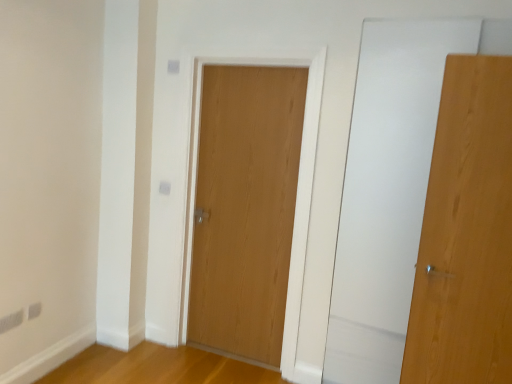
What is the approximate height of natural wood door at right, the second door positioned from the back?

natural wood door at right, the second door positioned from the back, is 1.76 meters tall.

The image size is (512, 384). What are the coordinates of `natural wood door at right, acting as the 1th door starting from the front` in the screenshot? It's located at click(466, 233).

The height and width of the screenshot is (384, 512). Describe the element at coordinates (466, 233) in the screenshot. I see `natural wood door at right, which appears as the 1th door when viewed from the right` at that location.

What do you see at coordinates (245, 208) in the screenshot?
I see `light oak wood door at center, which is the 2th door from front to back` at bounding box center [245, 208].

What is the approximate width of light oak wood door at center, placed as the first door when sorted from left to right?

light oak wood door at center, placed as the first door when sorted from left to right, is 3.90 inches wide.

You are a GUI agent. You are given a task and a screenshot of the screen. Output one action in this format:
    pyautogui.click(x=<x>, y=<y>)
    Task: Click on the light oak wood door at center, which is the 2th door from front to back
    
    Given the screenshot: What is the action you would take?
    pyautogui.click(x=245, y=208)

What is the approximate height of light oak wood door at center, which is the 2th door from front to back?

6.38 feet.

Locate an element on the screen. natural wood door at right, acting as the 1th door starting from the front is located at coordinates pos(466,233).

Between natural wood door at right, placed as the 2th door when sorted from left to right, and light oak wood door at center, placed as the first door when sorted from back to front, which one appears on the right side from the viewer's perspective?

From the viewer's perspective, natural wood door at right, placed as the 2th door when sorted from left to right, appears more on the right side.

Between natural wood door at right, placed as the 2th door when sorted from left to right, and light oak wood door at center, positioned as the 2th door in right-to-left order, which one is positioned in front?

natural wood door at right, placed as the 2th door when sorted from left to right, is in front.

Between point (509, 279) and point (225, 317), which one is positioned behind?

The point (225, 317) is behind.

From the image's perspective, which is below, natural wood door at right, the second door positioned from the back, or light oak wood door at center, placed as the first door when sorted from left to right?

natural wood door at right, the second door positioned from the back, from the image's perspective.

From a real-world perspective, is natural wood door at right, acting as the 1th door starting from the front, physically located above or below light oak wood door at center, placed as the first door when sorted from left to right?

natural wood door at right, acting as the 1th door starting from the front, is situated higher than light oak wood door at center, placed as the first door when sorted from left to right, in the real world.

Which object is thinner, natural wood door at right, which appears as the 1th door when viewed from the right, or light oak wood door at center, placed as the first door when sorted from back to front?

With smaller width is natural wood door at right, which appears as the 1th door when viewed from the right.

In terms of height, does natural wood door at right, the second door positioned from the back, look taller or shorter compared to light oak wood door at center, placed as the first door when sorted from left to right?

Considering their sizes, natural wood door at right, the second door positioned from the back, has less height than light oak wood door at center, placed as the first door when sorted from left to right.

Considering the sizes of objects natural wood door at right, acting as the 1th door starting from the front, and light oak wood door at center, which is the 2th door from front to back, in the image provided, who is smaller, natural wood door at right, acting as the 1th door starting from the front, or light oak wood door at center, which is the 2th door from front to back,?

natural wood door at right, acting as the 1th door starting from the front, is smaller.

Is natural wood door at right, the second door positioned from the back, positioned beyond the bounds of light oak wood door at center, positioned as the 2th door in right-to-left order?

Absolutely, natural wood door at right, the second door positioned from the back, is external to light oak wood door at center, positioned as the 2th door in right-to-left order.

In the scene shown: Is natural wood door at right, which appears as the 1th door when viewed from the right, beside light oak wood door at center, placed as the first door when sorted from left to right?

No, natural wood door at right, which appears as the 1th door when viewed from the right, is not in contact with light oak wood door at center, placed as the first door when sorted from left to right.

Could you tell me if natural wood door at right, the second door positioned from the back, is turned towards light oak wood door at center, placed as the first door when sorted from left to right?

No.

Can you tell me how much natural wood door at right, acting as the 1th door starting from the front, and light oak wood door at center, positioned as the 2th door in right-to-left order, differ in facing direction?

natural wood door at right, acting as the 1th door starting from the front, and light oak wood door at center, positioned as the 2th door in right-to-left order, are facing 5.55 degrees away from each other.

How distant is natural wood door at right, the second door positioned from the back, from light oak wood door at center, which is the 2th door from front to back?

A distance of 3.60 feet exists between natural wood door at right, the second door positioned from the back, and light oak wood door at center, which is the 2th door from front to back.

Where is `door below the light oak wood door at center, positioned as the 2th door in right-to-left order (from the image's perspective)`? This screenshot has height=384, width=512. door below the light oak wood door at center, positioned as the 2th door in right-to-left order (from the image's perspective) is located at coordinates (466, 233).

Is light oak wood door at center, positioned as the 2th door in right-to-left order, at the left side of natural wood door at right, the second door positioned from the back?

Correct, you'll find light oak wood door at center, positioned as the 2th door in right-to-left order, to the left of natural wood door at right, the second door positioned from the back.

Which object is further away from the camera, light oak wood door at center, positioned as the 2th door in right-to-left order, or natural wood door at right, which appears as the 1th door when viewed from the right?

light oak wood door at center, positioned as the 2th door in right-to-left order, is behind.

Which point is more distant from viewer, (256, 313) or (493, 143)?

The point (256, 313) is behind.

From the image's perspective, which is below, light oak wood door at center, which is the 2th door from front to back, or natural wood door at right, acting as the 1th door starting from the front?

natural wood door at right, acting as the 1th door starting from the front, from the image's perspective.

From a real-world perspective, who is located lower, light oak wood door at center, which is the 2th door from front to back, or natural wood door at right, placed as the 2th door when sorted from left to right?

From a 3D spatial view, light oak wood door at center, which is the 2th door from front to back, is below.

Considering the relative sizes of light oak wood door at center, which is the 2th door from front to back, and natural wood door at right, the second door positioned from the back, in the image provided, is light oak wood door at center, which is the 2th door from front to back, thinner than natural wood door at right, the second door positioned from the back,?

Incorrect, the width of light oak wood door at center, which is the 2th door from front to back, is not less than that of natural wood door at right, the second door positioned from the back.

Considering the relative sizes of light oak wood door at center, placed as the first door when sorted from left to right, and natural wood door at right, which appears as the 1th door when viewed from the right, in the image provided, is light oak wood door at center, placed as the first door when sorted from left to right, taller than natural wood door at right, which appears as the 1th door when viewed from the right,?

Yes, light oak wood door at center, placed as the first door when sorted from left to right, is taller than natural wood door at right, which appears as the 1th door when viewed from the right.

Considering the relative sizes of light oak wood door at center, placed as the first door when sorted from back to front, and natural wood door at right, placed as the 2th door when sorted from left to right, in the image provided, is light oak wood door at center, placed as the first door when sorted from back to front, bigger than natural wood door at right, placed as the 2th door when sorted from left to right,?

Correct, light oak wood door at center, placed as the first door when sorted from back to front, is larger in size than natural wood door at right, placed as the 2th door when sorted from left to right.

Is light oak wood door at center, placed as the first door when sorted from left to right, completely or partially outside of natural wood door at right, the second door positioned from the back?

Yes, light oak wood door at center, placed as the first door when sorted from left to right, is not within natural wood door at right, the second door positioned from the back.

Is light oak wood door at center, placed as the first door when sorted from left to right, placed right next to natural wood door at right, placed as the 2th door when sorted from left to right?

light oak wood door at center, placed as the first door when sorted from left to right, is not next to natural wood door at right, placed as the 2th door when sorted from left to right, and they're not touching.

In the scene shown: Could you tell me if light oak wood door at center, which is the 2th door from front to back, is turned towards natural wood door at right, placed as the 2th door when sorted from left to right?

No, light oak wood door at center, which is the 2th door from front to back, is not aimed at natural wood door at right, placed as the 2th door when sorted from left to right.

How far apart are light oak wood door at center, placed as the first door when sorted from left to right, and natural wood door at right, placed as the 2th door when sorted from left to right?

3.60 feet.

You are a GUI agent. You are given a task and a screenshot of the screen. Output one action in this format:
    pyautogui.click(x=<x>, y=<y>)
    Task: Click on the door on the right side of light oak wood door at center, positioned as the 2th door in right-to-left order
    The image size is (512, 384).
    Given the screenshot: What is the action you would take?
    pyautogui.click(x=466, y=233)

At what (x,y) coordinates should I click in order to perform the action: click on door below the natural wood door at right, acting as the 1th door starting from the front (from a real-world perspective). Please return your answer as a coordinate pair (x, y). Looking at the image, I should click on (245, 208).

The width and height of the screenshot is (512, 384). Identify the location of door above the light oak wood door at center, positioned as the 2th door in right-to-left order (from a real-world perspective). (466, 233).